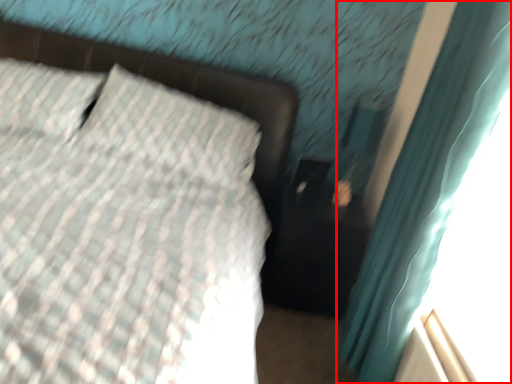
Question: From the image, what is the correct spatial relationship of curtain (annotated by the red box) in relation to bed frame?

Choices:
 (A) right
 (B) left

Answer: (A)